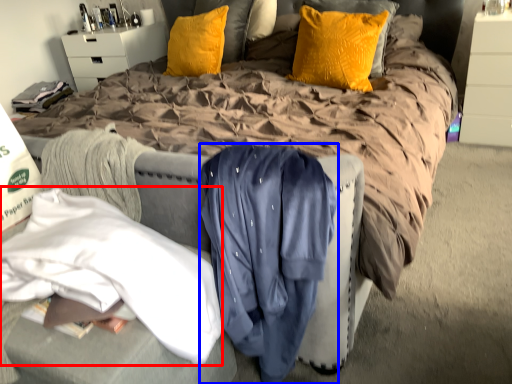
Question: Among these objects, which one is nearest to the camera, clothing (highlighted by a red box) or clothing (highlighted by a blue box)?

Choices:
 (A) clothing
 (B) clothing

Answer: (A)